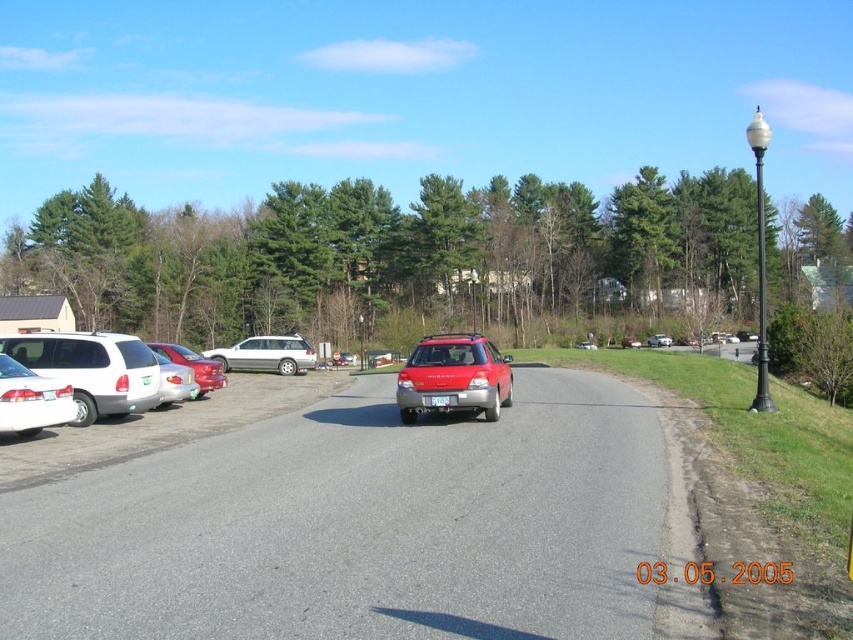
Is matte red station wagon at center taller than white plastic license plate at center?

Yes, matte red station wagon at center is taller than white plastic license plate at center.

Which is behind, point (485, 394) or point (450, 397)?

The point (485, 394) is more distant.

Find the location of a particular element. This screenshot has height=640, width=853. matte red station wagon at center is located at coordinates (454, 376).

Who is positioned more to the left, matte red station wagon at center or silver metallic station wagon at center-left?

silver metallic station wagon at center-left is more to the left.

In the scene shown: Who is more distant from viewer, (427, 369) or (270, 365)?

Point (270, 365)

Image resolution: width=853 pixels, height=640 pixels. I want to click on matte red station wagon at center, so click(454, 376).

Is point (49, 582) positioned behind point (15, 406)?

No.

Which is behind, point (563, 516) or point (44, 385)?

The point (44, 385) is more distant.

Identify the location of metallic silver car at center. Image resolution: width=853 pixels, height=640 pixels. (357, 525).